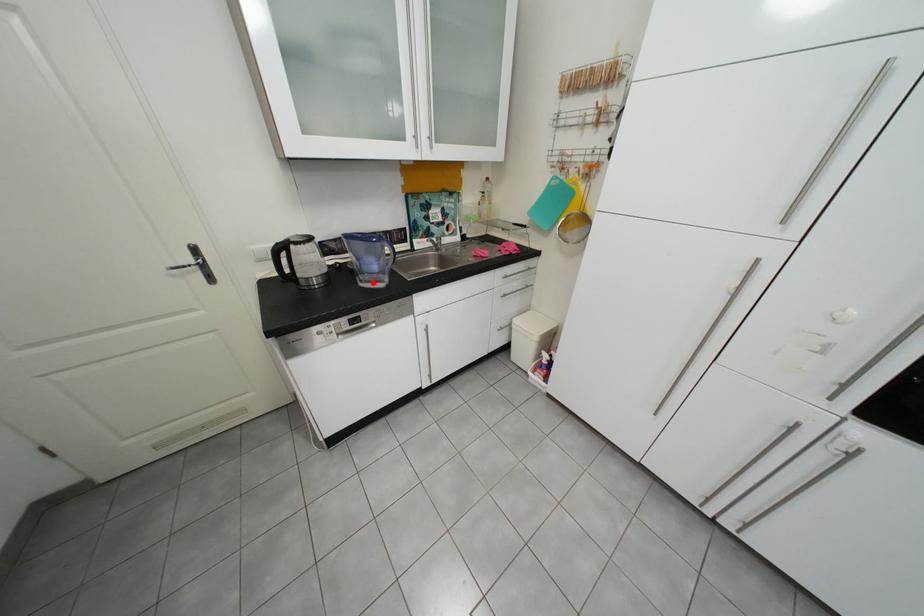
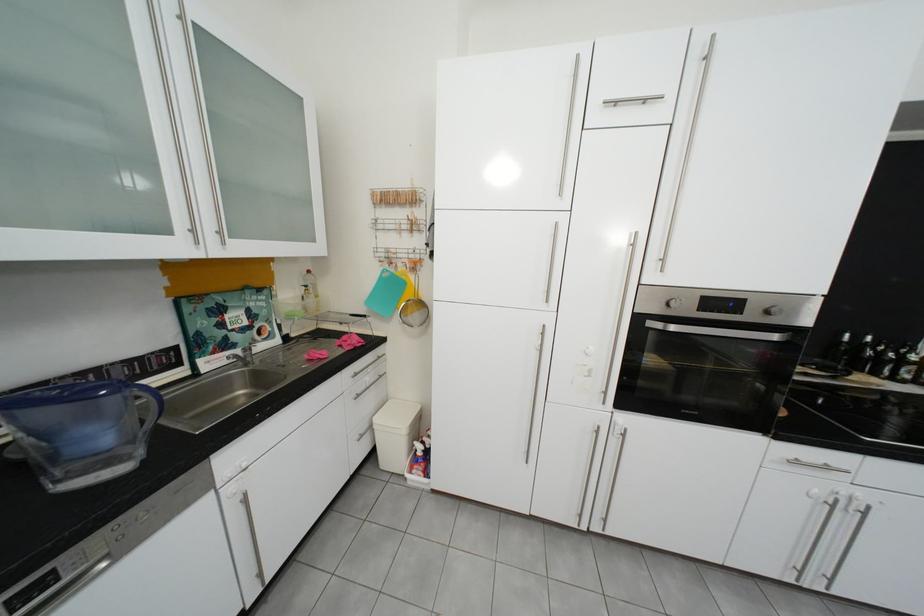
In the second image, find the point that corresponds to the highlighted location in the first image.

(70, 483)